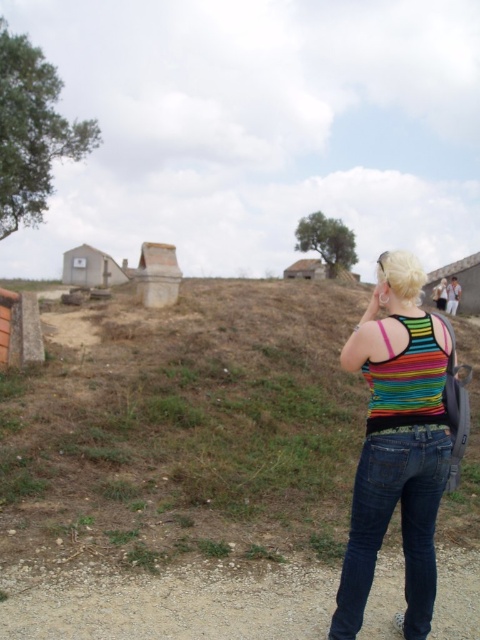
Question: Can you confirm if rainbow striped tank top at right is wider than white corrugated metal hut at lower left?

Choices:
 (A) no
 (B) yes

Answer: (A)

Question: Does brown grassy hillside at center come in front of white corrugated metal hut at lower left?

Choices:
 (A) yes
 (B) no

Answer: (A)

Question: Which point is closer to the camera taking this photo?

Choices:
 (A) (368, 352)
 (B) (83, 282)
 (C) (265, 301)

Answer: (A)

Question: Does rainbow striped tank top at right have a larger size compared to white corrugated metal hut at lower left?

Choices:
 (A) no
 (B) yes

Answer: (A)

Question: Estimate the real-world distances between objects in this image. Which object is farther from the white corrugated metal hut at lower left?

Choices:
 (A) brown grassy hillside at center
 (B) rainbow striped tank top at right

Answer: (B)

Question: Which object is the farthest from the rainbow striped tank top at right?

Choices:
 (A) brown grassy hillside at center
 (B) white corrugated metal hut at lower left

Answer: (B)